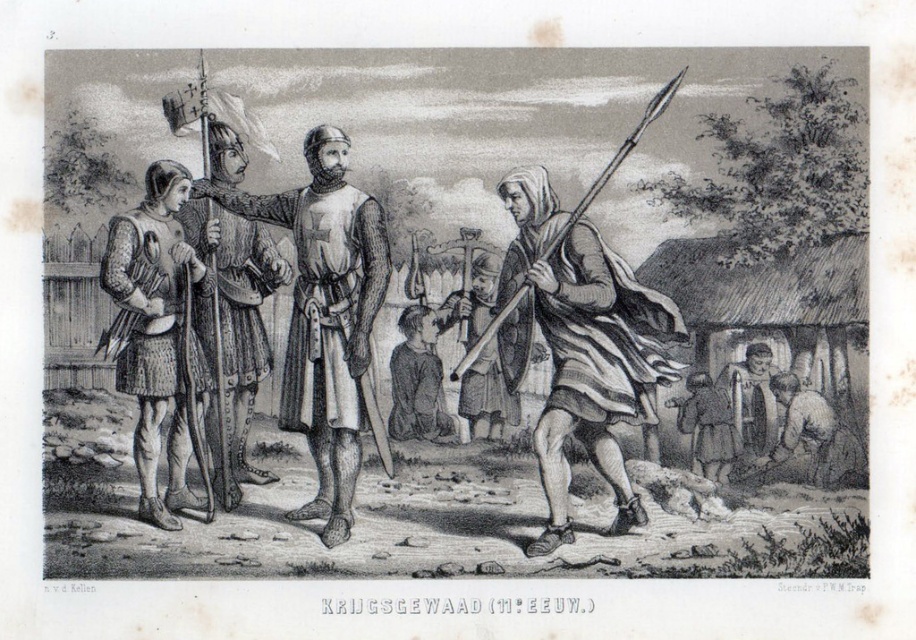
This screenshot has height=640, width=916. In order to click on metallic chainmail armor at center in this screenshot , I will do `click(322, 310)`.

Can you confirm if metallic chainmail armor at center is taller than brown leather bag at lower right?

Yes.

Locate an element on the screen. metallic chainmail armor at center is located at coordinates (x=322, y=310).

This screenshot has width=916, height=640. I want to click on metallic chainmail armor at center, so click(322, 310).

Between point (342, 211) and point (417, 340), which one is positioned behind?

The point (342, 211) is behind.

Between metallic chainmail armor at center and dark brown leather shoes at center, which one appears on the right side from the viewer's perspective?

dark brown leather shoes at center

Which is behind, point (342, 444) or point (431, 317)?

The point (342, 444) is more distant.

Image resolution: width=916 pixels, height=640 pixels. Identify the location of metallic chainmail armor at center. (322, 310).

Can you confirm if striped cloth cape at center is smaller than polished steel helmet at center?

No.

Can you confirm if striped cloth cape at center is positioned to the left of polished steel helmet at center?

No, striped cloth cape at center is not to the left of polished steel helmet at center.

Who is more forward, (515, 364) or (236, 224)?

Point (515, 364)

The image size is (916, 640). Identify the location of striped cloth cape at center. (580, 346).